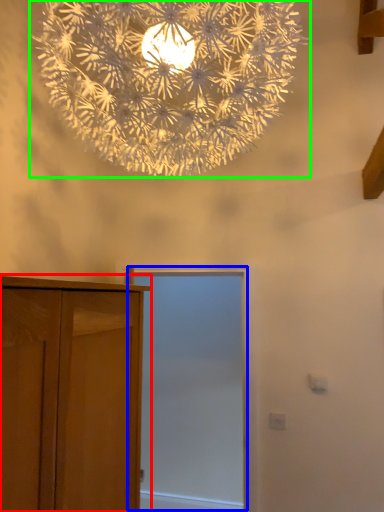
Question: Which is farther away from cupboard (highlighted by a red box)? screen door (highlighted by a blue box) or lamp (highlighted by a green box)?

Choices:
 (A) screen door
 (B) lamp

Answer: (A)